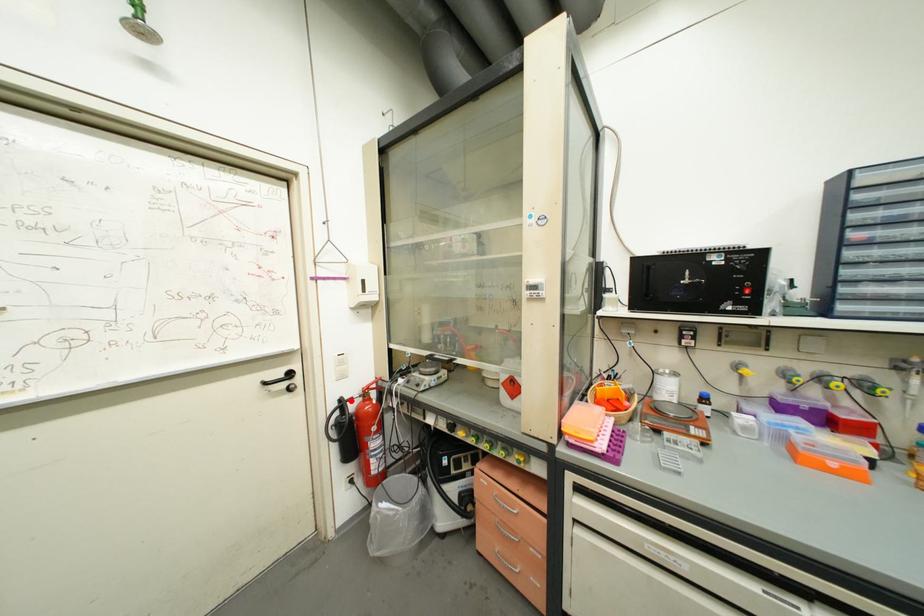
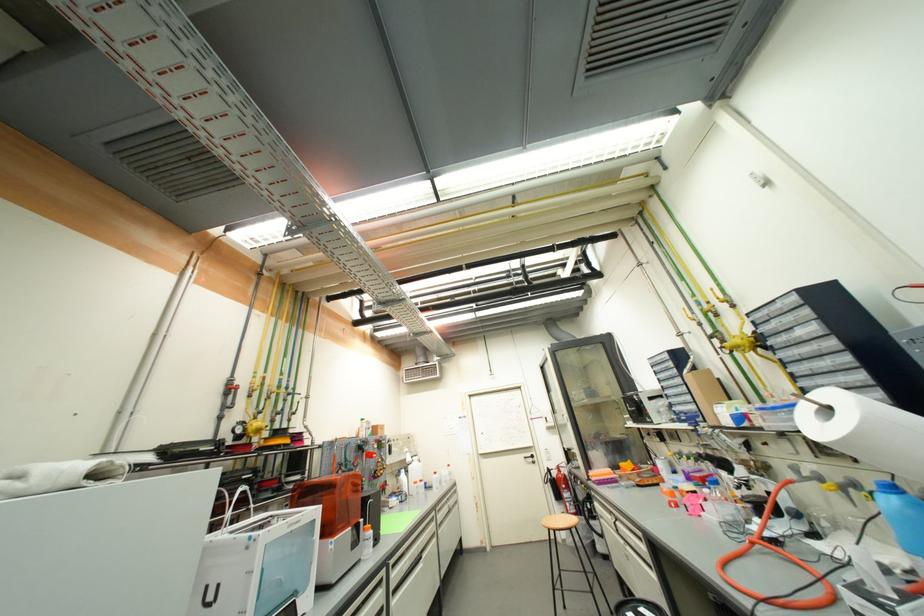
Locate, in the second image, the point that corresponds to the highlighted location in the first image.

(554, 469)